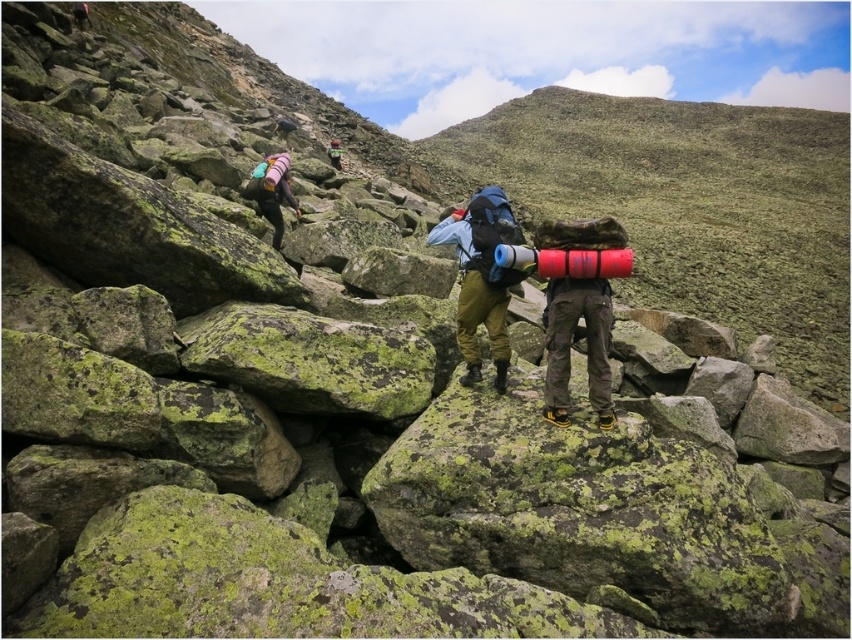
You are a hiker with a 2 meter long rope. You see two hikers wearing green camouflage pants at center. Can you use your rope to connect them?

The hikers wearing green camouflage pants at center are 6.48 meters apart. Since the rope is only 2 meters long, it is not long enough to connect them.

You are a drone operator trying to capture aerial footage of the hikers. You have two points marked on your screen, point (x=464, y=236) and point (x=337, y=157). Which point is better to focus on to get a clearer image of the hikers closer to the camera?

Point (x=464, y=236) is closer to the camera than point (x=337, y=157), so focusing on point (x=464, y=236) will provide a clearer image of the hikers that are nearer to the camera.